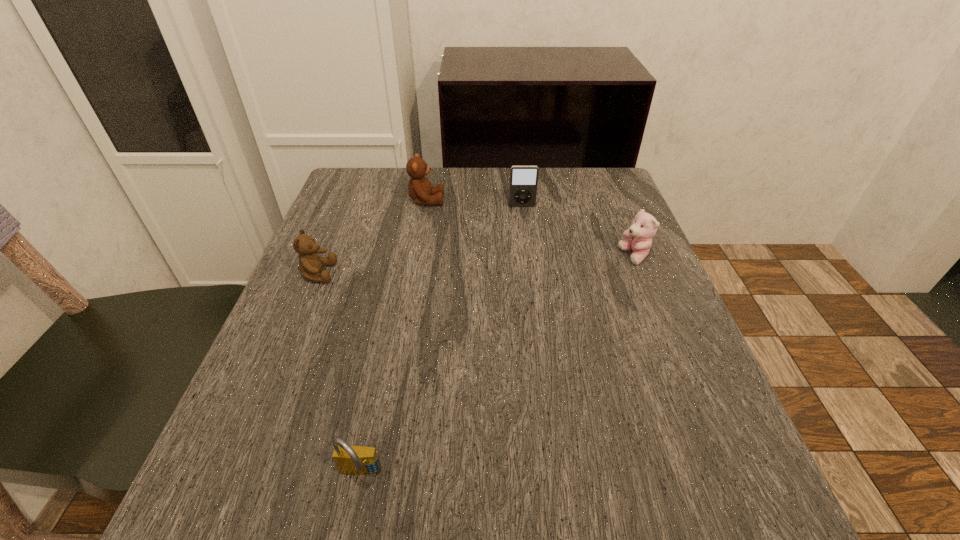
Locate an element on the screen. This screenshot has height=540, width=960. vacant space located 0.210m on the front-facing side of the leftmost object is located at coordinates (437, 273).

I want to click on vacant space situated on the side with the combination dials of the nearest object, so click(349, 530).

At what (x,y) coordinates should I click in order to perform the action: click on teddy bear that is at the far edge. Please return your answer as a coordinate pair (x, y). This screenshot has height=540, width=960. Looking at the image, I should click on (419, 187).

Locate an element on the screen. This screenshot has height=540, width=960. iPod that is at the far edge is located at coordinates (523, 179).

Image resolution: width=960 pixels, height=540 pixels. Find the location of `object that is at the near edge`. object that is at the near edge is located at coordinates (356, 460).

At what (x,y) coordinates should I click in order to perform the action: click on object present at the left edge. Please return your answer as a coordinate pair (x, y). Image resolution: width=960 pixels, height=540 pixels. Looking at the image, I should click on (310, 264).

At what (x,y) coordinates should I click in order to perform the action: click on object that is positioned at the right edge. Please return your answer as a coordinate pair (x, y). Looking at the image, I should click on (644, 227).

Where is `vacant space at the far edge of the desktop`? This screenshot has width=960, height=540. vacant space at the far edge of the desktop is located at coordinates (468, 170).

Locate an element on the screen. The height and width of the screenshot is (540, 960). free spot at the near edge of the desktop is located at coordinates (323, 528).

The height and width of the screenshot is (540, 960). What are the coordinates of `free space at the left edge of the desktop` in the screenshot? It's located at (323, 320).